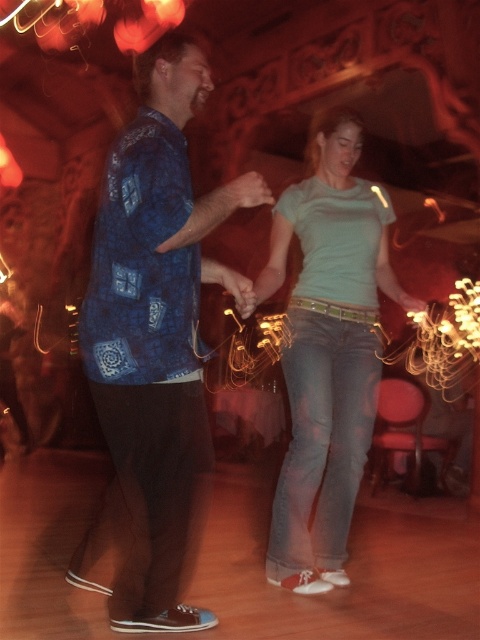
Question: Is blue printed shirt at center wider than light blue denim jeans at center?

Choices:
 (A) no
 (B) yes

Answer: (B)

Question: Does blue printed shirt at center lie in front of light blue denim jeans at center?

Choices:
 (A) yes
 (B) no

Answer: (A)

Question: Which object appears closest to the camera in this image?

Choices:
 (A) light blue denim jeans at center
 (B) blue printed shirt at center

Answer: (B)

Question: Considering the relative positions of blue printed shirt at center and light blue denim jeans at center in the image provided, where is blue printed shirt at center located with respect to light blue denim jeans at center?

Choices:
 (A) right
 (B) left

Answer: (B)

Question: Among these objects, which one is nearest to the camera?

Choices:
 (A) light blue denim jeans at center
 (B) blue printed shirt at center

Answer: (B)